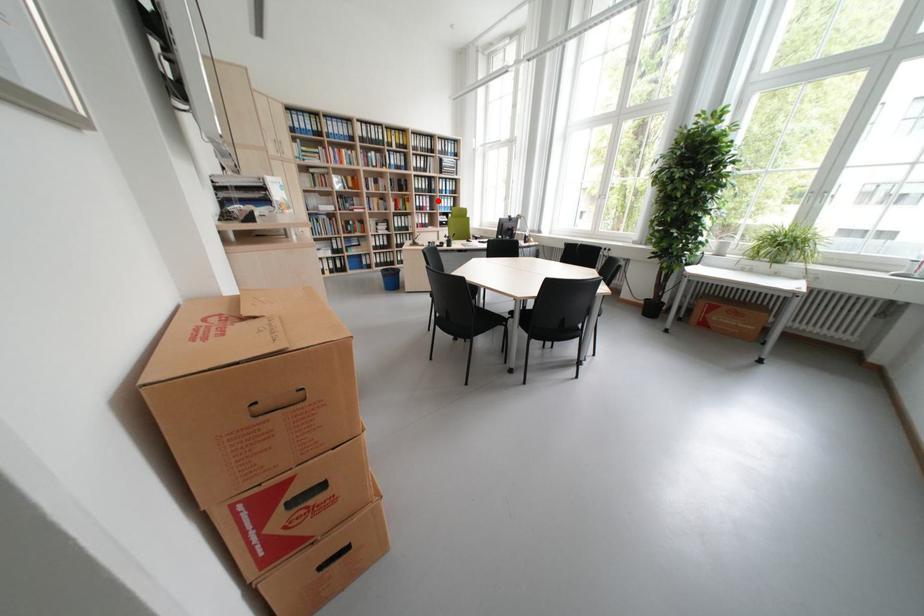
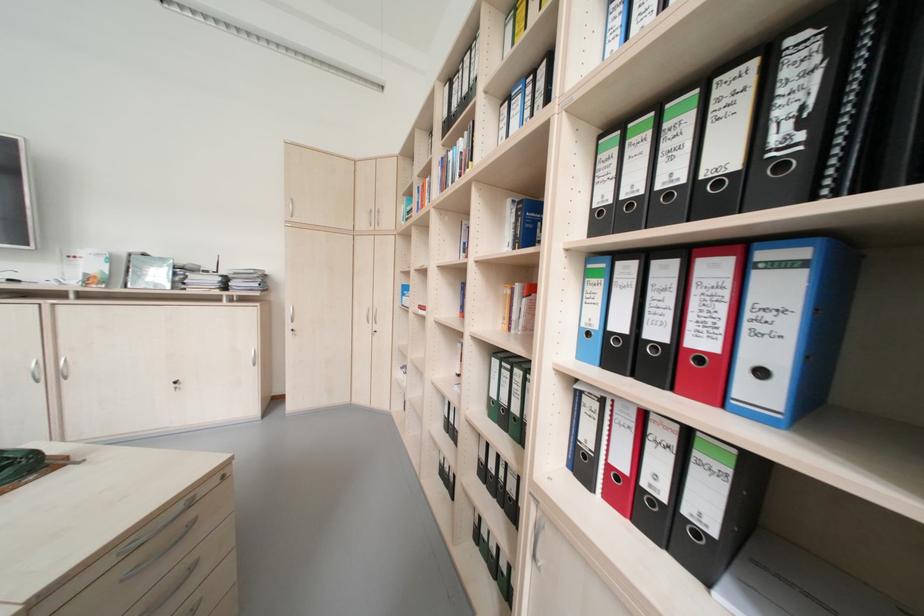
Find the pixel in the second image that matches the highlighted location in the first image.

(793, 290)